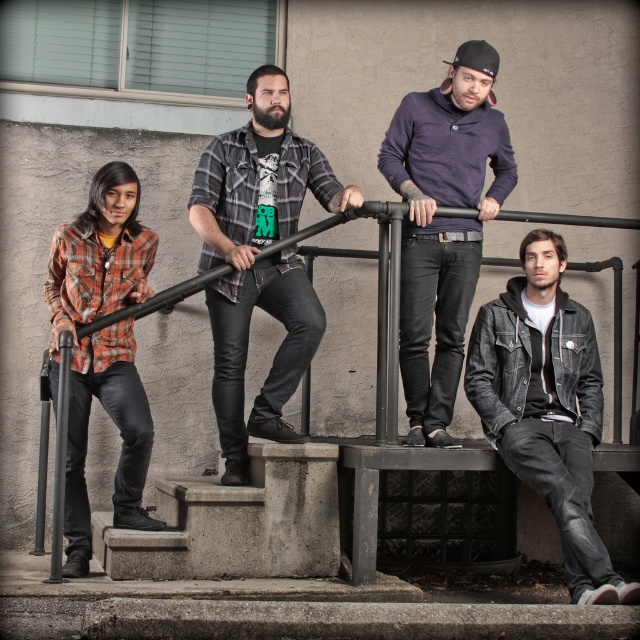
Can you confirm if purple sweater at center is positioned below plaid flannel shirt at left?

Incorrect, purple sweater at center is not positioned below plaid flannel shirt at left.

Does purple sweater at center have a larger size compared to plaid flannel shirt at left?

Indeed, purple sweater at center has a larger size compared to plaid flannel shirt at left.

The image size is (640, 640). I want to click on purple sweater at center, so click(x=444, y=225).

The image size is (640, 640). What are the coordinates of `purple sweater at center` in the screenshot? It's located at (444, 225).

Is denim jacket at lower right smaller than concrete stairs at lower center?

Actually, denim jacket at lower right might be larger than concrete stairs at lower center.

Image resolution: width=640 pixels, height=640 pixels. What do you see at coordinates (547, 404) in the screenshot?
I see `denim jacket at lower right` at bounding box center [547, 404].

Find the location of `denim jacket at lower right`. denim jacket at lower right is located at coordinates (547, 404).

Can you confirm if plaid flannel shirt at left is taller than concrete stairs at lower center?

Indeed, plaid flannel shirt at left has a greater height compared to concrete stairs at lower center.

I want to click on plaid flannel shirt at left, so click(x=120, y=435).

Find the location of a particular element. This screenshot has height=640, width=640. plaid flannel shirt at left is located at coordinates pos(120,435).